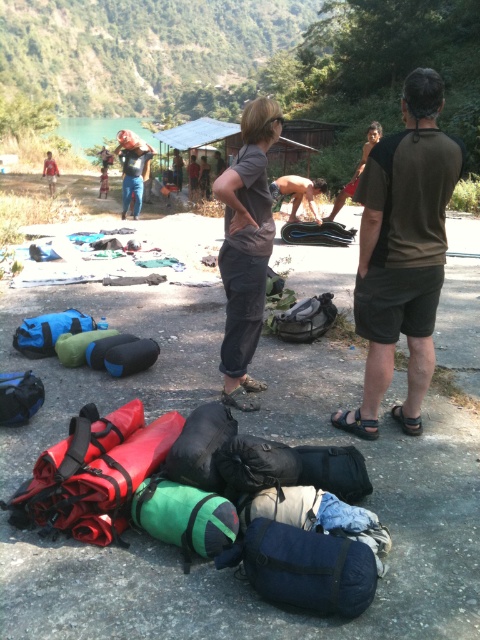
Does brown/cotton t-shirt at right appear on the right side of matte blue jeans at center?

Correct, you'll find brown/cotton t-shirt at right to the right of matte blue jeans at center.

The image size is (480, 640). I want to click on brown/cotton t-shirt at right, so click(403, 252).

Which is behind, point (433, 308) or point (126, 205)?

The point (126, 205) is behind.

At what (x,y) coordinates should I click in order to perform the action: click on brown/cotton t-shirt at right. Please return your answer as a coordinate pair (x, y). This screenshot has width=480, height=640. Looking at the image, I should click on (403, 252).

Is point (317, 316) in front of point (123, 179)?

Yes, it is.

Between matte black backpack at center and matte blue jeans at center, which one is positioned lower?

Positioned lower is matte black backpack at center.

Describe the element at coordinates (304, 317) in the screenshot. I see `matte black backpack at center` at that location.

The image size is (480, 640). I want to click on matte black backpack at center, so click(x=304, y=317).

Can you confirm if brown/cotton t-shirt at right is positioned to the right of matte black backpack at center?

Yes, brown/cotton t-shirt at right is to the right of matte black backpack at center.

Which is in front, point (389, 291) or point (298, 307)?

Point (389, 291) is in front.

Locate an element on the screen. The image size is (480, 640). brown/cotton t-shirt at right is located at coordinates (403, 252).